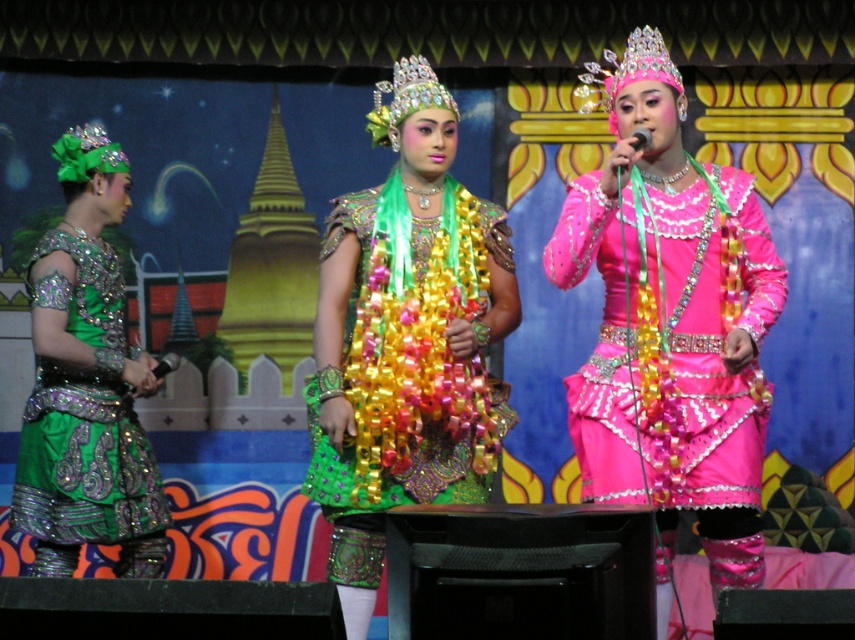
In the scene shown: How distant is pink sequined dress at center from shiny green fabric dress at center?

pink sequined dress at center is 3.44 feet from shiny green fabric dress at center.

Who is positioned more to the left, pink sequined dress at center or shiny green fabric dress at center?

shiny green fabric dress at center is more to the left.

At what (x,y) coordinates should I click in order to perform the action: click on pink sequined dress at center. Please return your answer as a coordinate pair (x, y). The width and height of the screenshot is (855, 640). Looking at the image, I should click on (670, 324).

Which is more to the left, pink sequined dress at center or green sequined dress at left?

green sequined dress at left is more to the left.

Image resolution: width=855 pixels, height=640 pixels. Find the location of `pink sequined dress at center`. pink sequined dress at center is located at coordinates (670, 324).

Describe the element at coordinates (670, 324) in the screenshot. I see `pink sequined dress at center` at that location.

At what (x,y) coordinates should I click in order to perform the action: click on pink sequined dress at center. Please return your answer as a coordinate pair (x, y). Looking at the image, I should click on (670, 324).

Does point (455, 349) lie behind point (115, 378)?

No, it is in front of (115, 378).

Is point (348, 472) closer to viewer compared to point (139, 436)?

Yes, point (348, 472) is closer to viewer.

Where is `shiny green fabric dress at center`? shiny green fabric dress at center is located at coordinates (405, 339).